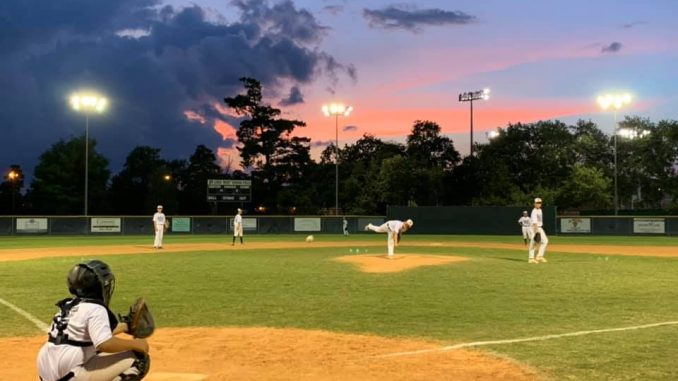
What are the coordinates of `plate` in the screenshot? It's located at (158, 375).